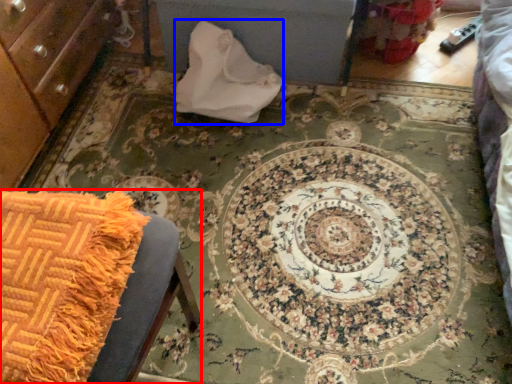
Question: Which object is further to the camera taking this photo, furniture (highlighted by a red box) or material (highlighted by a blue box)?

Choices:
 (A) furniture
 (B) material

Answer: (B)